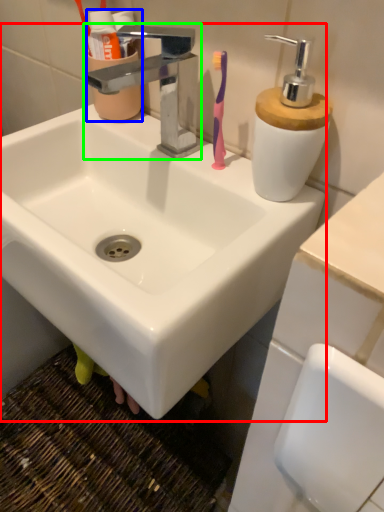
Question: Based on their relative distances, which object is farther from sink (highlighted by a red box)? Choose from mouthwash (highlighted by a blue box) and tap (highlighted by a green box).

Choices:
 (A) mouthwash
 (B) tap

Answer: (A)